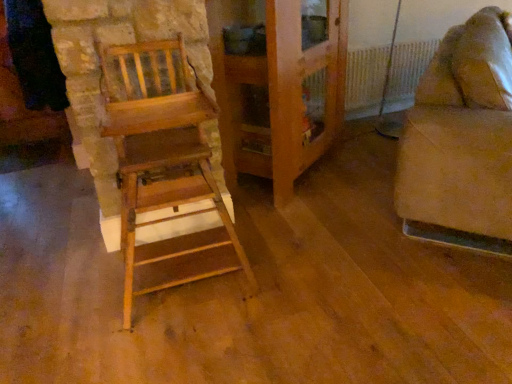
In order to click on free spot to the left of wooden chair at left, marked as the 2th furniture in a right-to-left arrangement in this screenshot , I will do `click(68, 289)`.